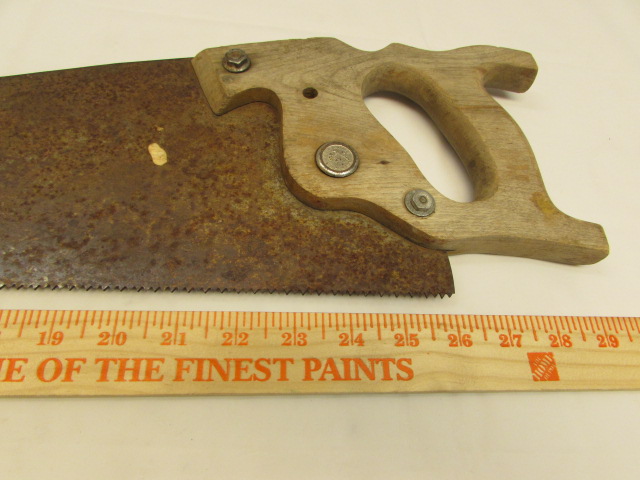
Find the location of a particular element. The width and height of the screenshot is (640, 480). handle is located at coordinates [x=355, y=144].